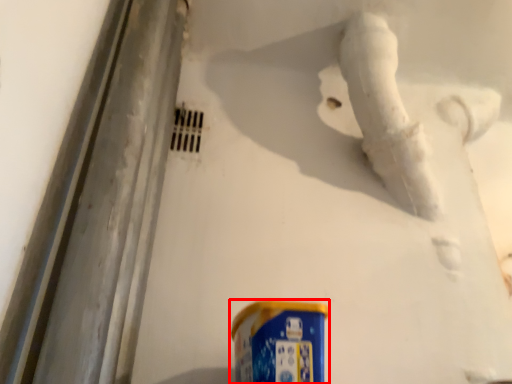
Question: Where is spray can (annotated by the red box) located in relation to water pipe in the image?

Choices:
 (A) right
 (B) left

Answer: (B)